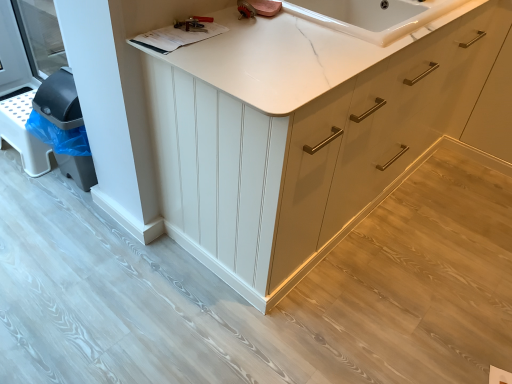
Image resolution: width=512 pixels, height=384 pixels. Identify the location of matte white cabinet at center. (300, 139).

Does white marble countertop at upper center have a greater height compared to matte white cabinet at center?

Incorrect, the height of white marble countertop at upper center is not larger of that of matte white cabinet at center.

Is white marble countertop at upper center with matte white cabinet at center?

white marble countertop at upper center and matte white cabinet at center are clearly separated.

From a real-world perspective, is white marble countertop at upper center below matte white cabinet at center?

No, from a real-world perspective, white marble countertop at upper center is not under matte white cabinet at center.

Which object is positioned more to the left, white marble countertop at upper center or matte white cabinet at center?

white marble countertop at upper center is more to the left.

Looking at this image, how different are the orientations of matte white cabinet at center and metallic silver wrench at upper center in degrees?

There is a 3.75-degree angle between the facing directions of matte white cabinet at center and metallic silver wrench at upper center.

Would you say matte white cabinet at center is inside or outside metallic silver wrench at upper center?

matte white cabinet at center exists outside the volume of metallic silver wrench at upper center.

Is matte white cabinet at center looking in the opposite direction of metallic silver wrench at upper center?

No, matte white cabinet at center's orientation is not away from metallic silver wrench at upper center.

Is matte white cabinet at center not close to metallic silver wrench at upper center?

They are positioned close to each other.

Considering the relative sizes of metallic silver wrench at upper center and matte white cabinet at center in the image provided, is metallic silver wrench at upper center smaller than matte white cabinet at center?

Correct, metallic silver wrench at upper center occupies less space than matte white cabinet at center.

Is metallic silver wrench at upper center directly adjacent to matte white cabinet at center?

No, metallic silver wrench at upper center is not making contact with matte white cabinet at center.

Can you confirm if metallic silver wrench at upper center is positioned to the right of matte white cabinet at center?

No, metallic silver wrench at upper center is not to the right of matte white cabinet at center.

Is metallic silver wrench at upper center wider than matte white cabinet at center?

No, metallic silver wrench at upper center is not wider than matte white cabinet at center.

At what (x,y) coordinates should I click in order to perform the action: click on countertop that appears behind the matte white cabinet at center. Please return your answer as a coordinate pair (x, y). The height and width of the screenshot is (384, 512). Looking at the image, I should click on (305, 61).

From a real-world perspective, between matte white cabinet at center and white marble countertop at upper center, who is vertically lower?

matte white cabinet at center is physically lower.

In terms of size, does matte white cabinet at center appear bigger or smaller than white marble countertop at upper center?

matte white cabinet at center is bigger than white marble countertop at upper center.

Considering the relative sizes of matte white cabinet at center and white marble countertop at upper center in the image provided, is matte white cabinet at center taller than white marble countertop at upper center?

Yes.

Looking at this image, would you say white marble countertop at upper center is inside or outside metallic silver wrench at upper center?

white marble countertop at upper center is not enclosed by metallic silver wrench at upper center.

How distant is white marble countertop at upper center from metallic silver wrench at upper center?

white marble countertop at upper center and metallic silver wrench at upper center are 13.64 inches apart from each other.

Is white marble countertop at upper center facing away from metallic silver wrench at upper center?

No, white marble countertop at upper center is not facing the opposite direction of metallic silver wrench at upper center.

I want to click on countertop located underneath the metallic silver wrench at upper center (from a real-world perspective), so click(x=305, y=61).

Measure the distance between metallic silver wrench at upper center and white marble countertop at upper center.

metallic silver wrench at upper center and white marble countertop at upper center are 13.64 inches apart.

Which of these two, metallic silver wrench at upper center or white marble countertop at upper center, is thinner?

Thinner between the two is metallic silver wrench at upper center.

Between metallic silver wrench at upper center and white marble countertop at upper center, which one has smaller size?

Smaller between the two is metallic silver wrench at upper center.

Consider the image. Is metallic silver wrench at upper center facing away from white marble countertop at upper center?

No, metallic silver wrench at upper center is not facing away from white marble countertop at upper center.

Find the location of `countertop that is on the left side of matte white cabinet at center`. countertop that is on the left side of matte white cabinet at center is located at coordinates (305, 61).

Locate an element on the screen. Image resolution: width=512 pixels, height=384 pixels. cabinetry in front of the metallic silver wrench at upper center is located at coordinates (300, 139).

Based on their spatial positions, is white marble countertop at upper center or metallic silver wrench at upper center closer to matte white cabinet at center?

The object closer to matte white cabinet at center is white marble countertop at upper center.

When comparing their distances from matte white cabinet at center, does metallic silver wrench at upper center or white marble countertop at upper center seem closer?

Among the two, white marble countertop at upper center is located nearer to matte white cabinet at center.

Which object lies nearer to the anchor point white marble countertop at upper center, matte white cabinet at center or metallic silver wrench at upper center?

matte white cabinet at center is closer to white marble countertop at upper center.

When comparing their distances from metallic silver wrench at upper center, does white marble countertop at upper center or matte white cabinet at center seem further?

Among the two, matte white cabinet at center is located further to metallic silver wrench at upper center.

Estimate the real-world distances between objects in this image. Which object is closer to metallic silver wrench at upper center, matte white cabinet at center or white marble countertop at upper center?

The object closer to metallic silver wrench at upper center is white marble countertop at upper center.

When comparing their distances from white marble countertop at upper center, does metallic silver wrench at upper center or matte white cabinet at center seem closer?

matte white cabinet at center is positioned closer to the anchor white marble countertop at upper center.

Where is `countertop situated between metallic silver wrench at upper center and matte white cabinet at center from left to right`? The height and width of the screenshot is (384, 512). countertop situated between metallic silver wrench at upper center and matte white cabinet at center from left to right is located at coordinates (305, 61).